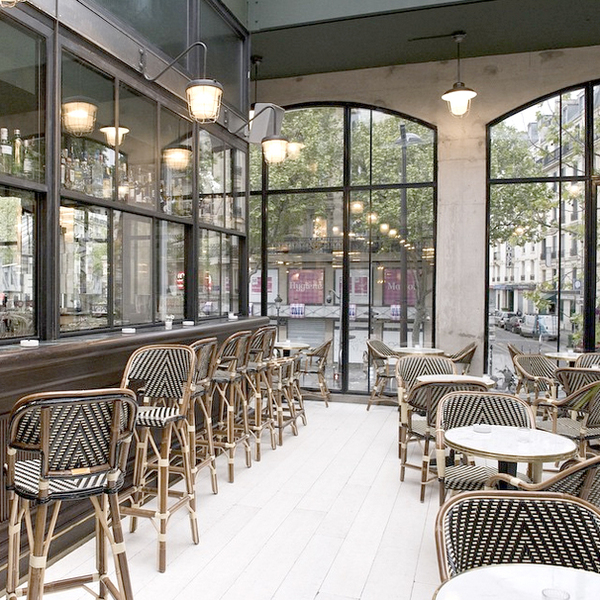
At what (x,y) coordinates should I click in order to perform the action: click on chairs at the bar. Please return your answer as a coordinate pair (x, y). The image size is (600, 600). Looking at the image, I should click on (79, 445), (162, 372), (204, 358), (234, 347), (260, 341), (287, 361).